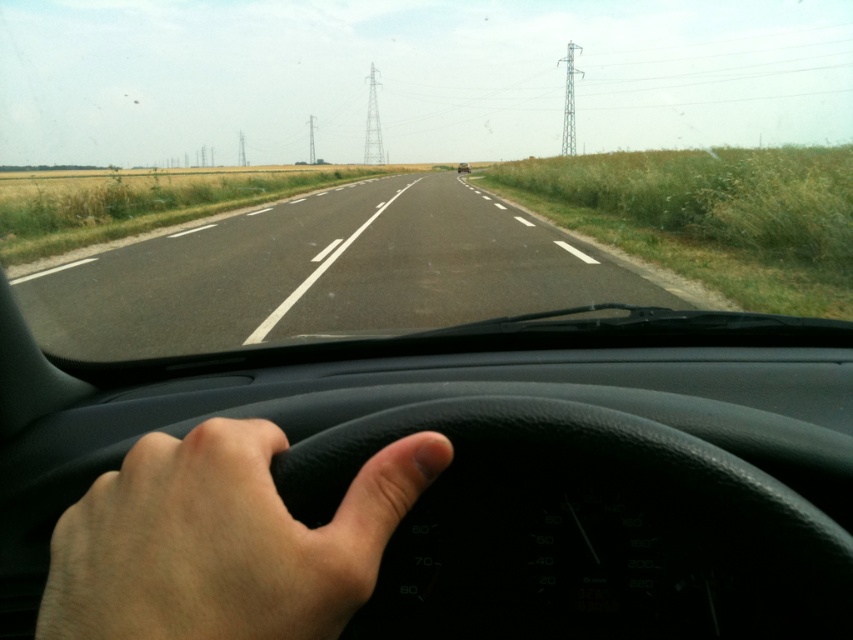
Does light skin/soft touch hand at center appear over metallic silver car at center?

No.

In the scene shown: Who is positioned more to the right, light skin/soft touch hand at center or metallic silver car at center?

From the viewer's perspective, metallic silver car at center appears more on the right side.

Between point (396, 492) and point (457, 172), which one is positioned behind?

Positioned behind is point (457, 172).

The width and height of the screenshot is (853, 640). I want to click on light skin/soft touch hand at center, so click(223, 540).

Can you confirm if transparent glass windshield at center is taller than light skin/soft touch hand at center?

Indeed, transparent glass windshield at center has a greater height compared to light skin/soft touch hand at center.

Between transparent glass windshield at center and light skin/soft touch hand at center, which one appears on the right side from the viewer's perspective?

light skin/soft touch hand at center is more to the right.

Which is in front, point (86, 246) or point (334, 637)?

Point (334, 637) is in front.

Where is `transparent glass windshield at center`? transparent glass windshield at center is located at coordinates (413, 160).

Can you confirm if asphalt road at center is bigger than metallic silver car at center?

Yes.

Is point (527, 225) closer to camera compared to point (457, 166)?

That is True.

Where is `asphalt road at center`? asphalt road at center is located at coordinates (322, 273).